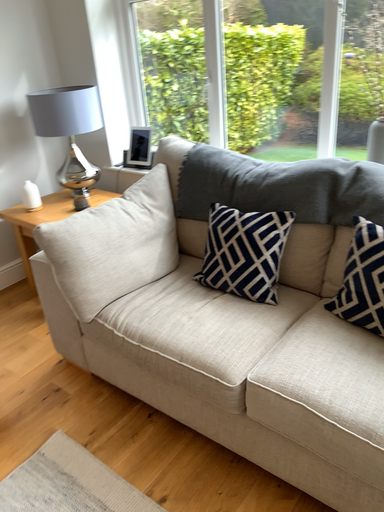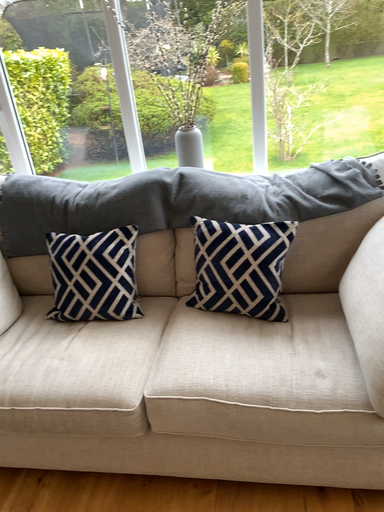
Question: Which way did the camera rotate in the video?

Choices:
 (A) rotated right
 (B) rotated left

Answer: (A)